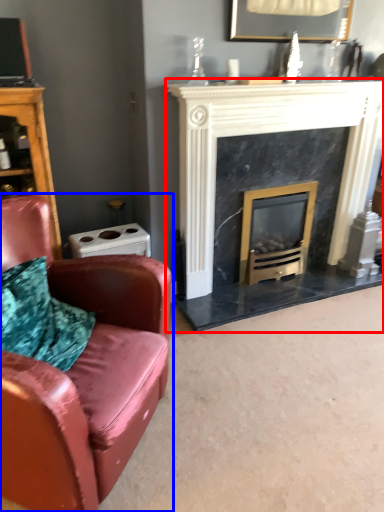
Question: Which object appears closest to the camera in this image, fireplace (highlighted by a red box) or chair (highlighted by a blue box)?

Choices:
 (A) fireplace
 (B) chair

Answer: (B)